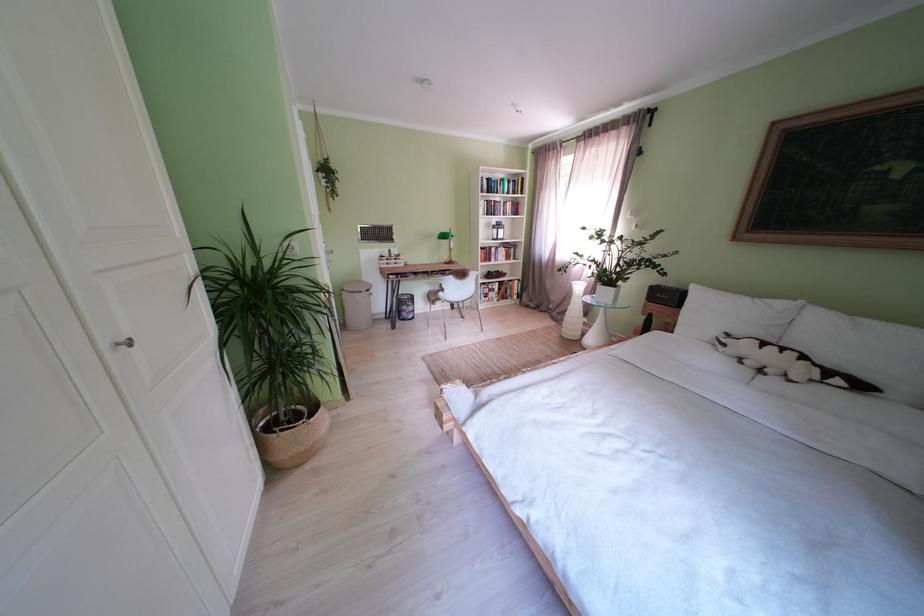
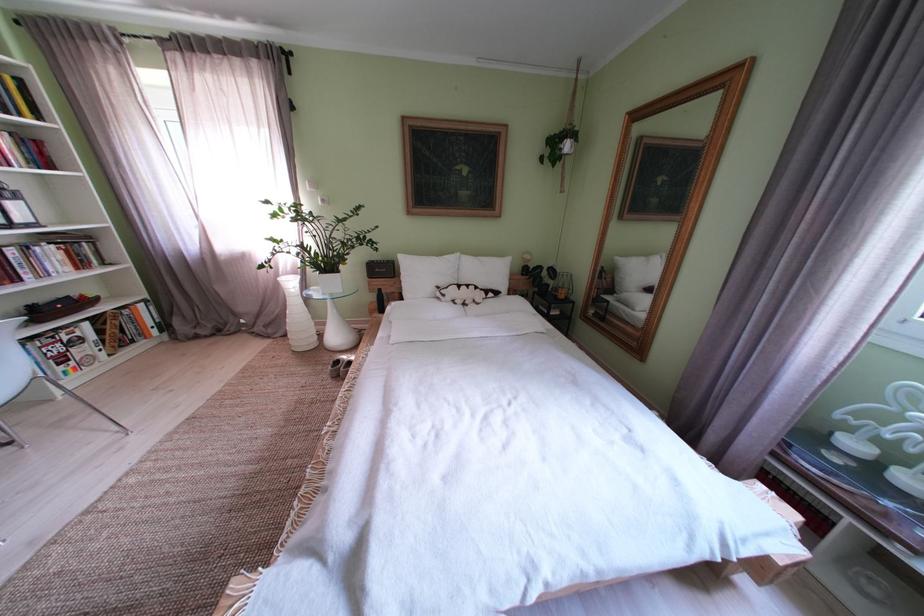
Where in the second image is the point corresponding to (578,323) from the first image?

(301, 334)